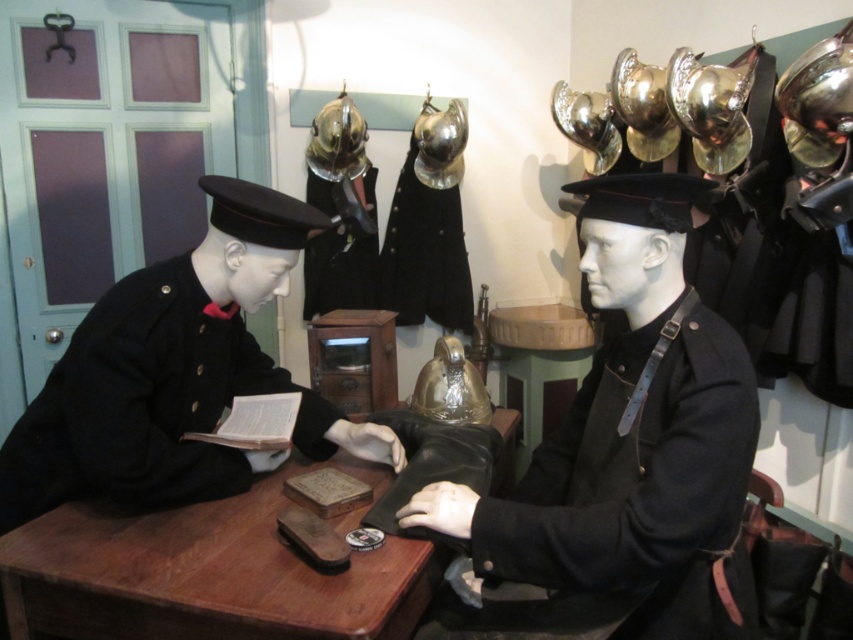
You are a museum curator planning to place a protective glass cover over the black woolen jacket at center and the shiny metallic helmet at center. If the glass cover must be large enough to cover both items completely, which item determines the minimum required size of the glass cover?

The black woolen jacket at center is bigger than the shiny metallic helmet at center, so the glass cover must be at least as large as the black woolen jacket at center to cover both items completely.

You are a museum visitor looking at the helmets displayed on the wall. You notice two helmets, the shiny gold helmet at center and the shiny metallic helmet at upper center. Which helmet is located to the right of the other?

The shiny gold helmet at center is positioned on the right side of the shiny metallic helmet at upper center.

You are a museum curator preparing to move the black woolen jacket at center and the black woolen uniform at left to a new display case. The case has a divider that allows only items within 25 inches of each other to be placed together. Can you place both items together in this section?

The black woolen jacket at center is 26.89 inches from the black woolen uniform at left. Since the divider requires items to be within 25 inches to be placed together, they cannot be placed in the same section as the distance exceeds the limit.